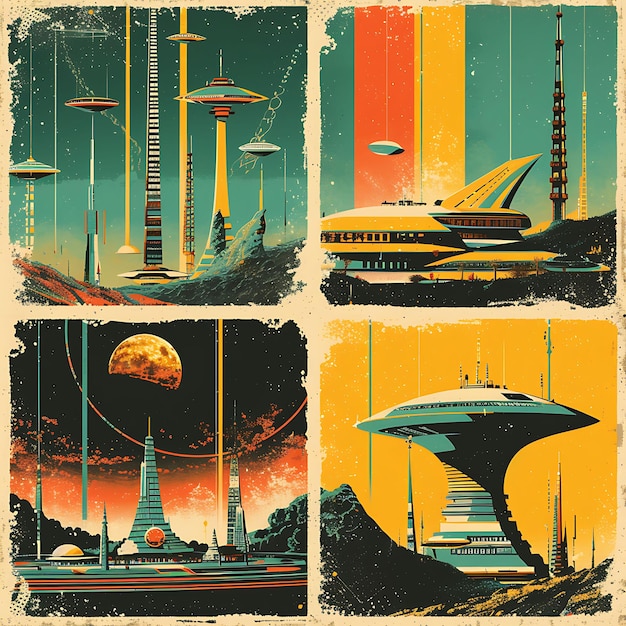
You are a GUI agent. You are given a task and a screenshot of the screen. Output one action in this format:
    pyautogui.click(x=<x>, y=<y>)
    Task: Click on the saucer
    Image resolution: width=626 pixels, height=626 pixels.
    Given the screenshot: What is the action you would take?
    pyautogui.click(x=17, y=167), pyautogui.click(x=81, y=93), pyautogui.click(x=253, y=90), pyautogui.click(x=265, y=156)